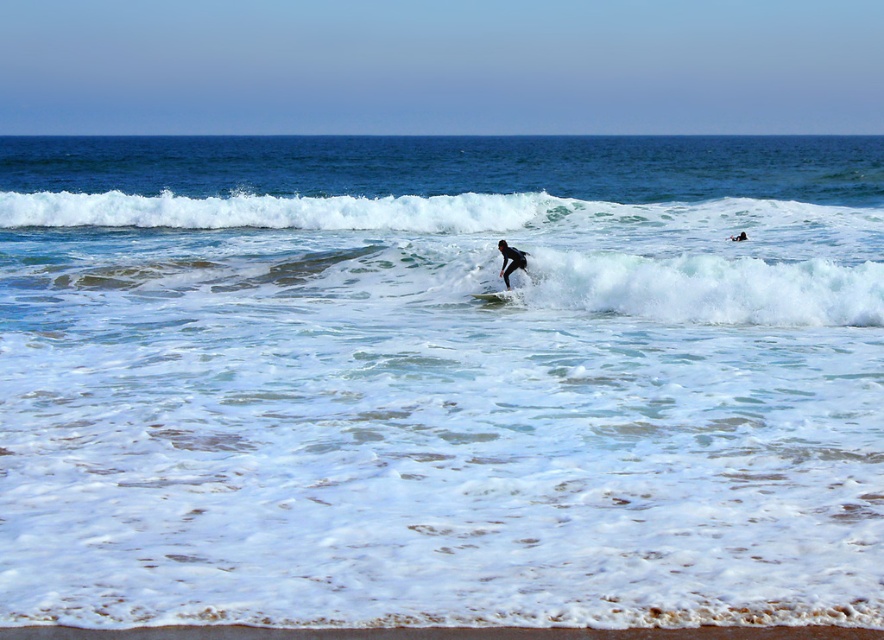
Is white foamy wave at upper center bigger than white foam surfboard at center?

Yes, white foamy wave at upper center is bigger than white foam surfboard at center.

Who is more distant from viewer, (x=286, y=198) or (x=509, y=298)?

Point (x=286, y=198)

This screenshot has width=884, height=640. I want to click on white foamy wave at upper center, so click(433, 212).

Does white foamy wave at upper center have a greater height compared to black rubber wetsuit at center?

Yes, white foamy wave at upper center is taller than black rubber wetsuit at center.

Is white foamy wave at upper center smaller than black rubber wetsuit at center?

No, white foamy wave at upper center is not smaller than black rubber wetsuit at center.

You are a GUI agent. You are given a task and a screenshot of the screen. Output one action in this format:
    pyautogui.click(x=<x>, y=<y>)
    Task: Click on the white foamy wave at upper center
    The image size is (884, 640).
    Given the screenshot: What is the action you would take?
    click(x=433, y=212)

Is black rubber wetsuit at center thinner than white foam surfboard at center?

Yes, black rubber wetsuit at center is thinner than white foam surfboard at center.

Is point (508, 275) positioned in front of point (500, 292)?

That is False.

Where is `black rubber wetsuit at center`? This screenshot has height=640, width=884. black rubber wetsuit at center is located at coordinates (509, 260).